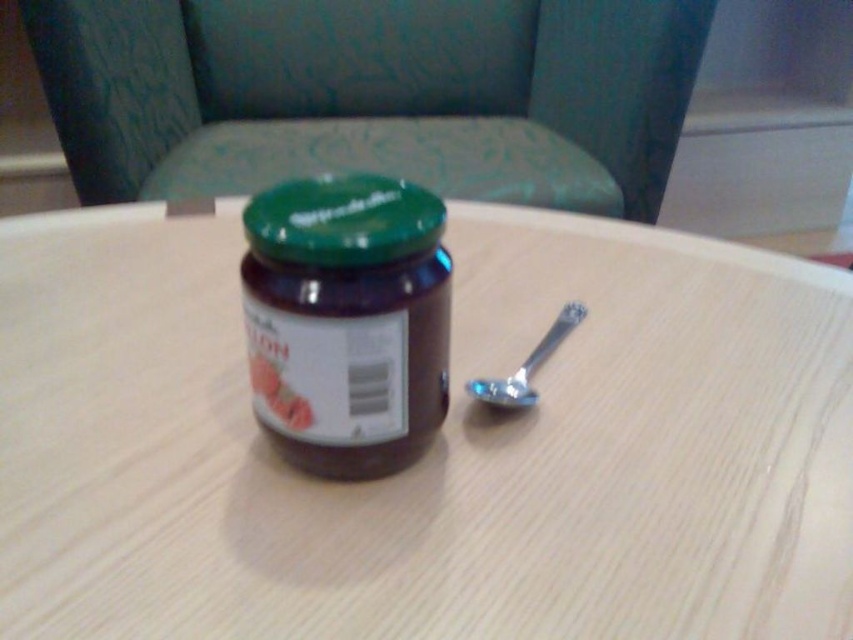
You are setting up a small breakfast nook and want to arrange the green matte jar lid at center and the silver metallic spoon at lower right in a way that aligns with their current positions. Which object should you place first to maintain their relative positions?

The green matte jar lid at center is positioned on the left side of the silver metallic spoon at lower right, so you should place the green matte jar lid at center first to maintain their relative positions.

You are standing in front of a table with a jar of jam and a spoon. There is a chair in the background. A point at coordinates [401,381] is 11.47 inches from the camera. If you want to place a small sticker exactly at that point, which object on the table would it be closest to?

The point at coordinates [401,381] is 11.47 inches from the camera, so the sticker would be closest to the jar of jam.

You are sitting at the round wooden table and want to reach both the jar of jam and the spoon. Which object is closer to you, the point at position (x=505, y=224) or the point at (x=581, y=304)?

The point at position (x=505, y=224) is closer to you than the point at (x=581, y=304) because it is further to the viewer.